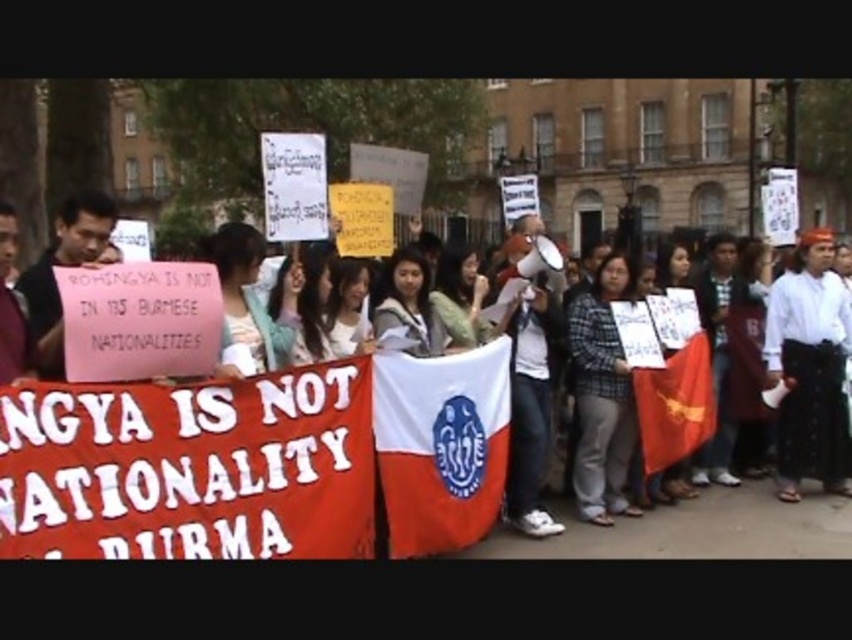
You are a photographer trying to capture the white fabric flag at center in the protest scene. Based on its position coordinates, where should you aim your camera to ensure the flag is centered in your shot?

The white fabric flag at center is located at coordinates point (441,445), so you should aim your camera at that specific point to center the flag in your shot.

You are a photographer trying to capture the protest scene. You want to ensure both the white fabric banner at center and the white fabric flag at center are clearly visible in your photo. Given their sizes, which object should you focus on first to ensure it doesn

The white fabric banner at center is much taller than the white fabric flag at center, so you should focus on capturing the white fabric banner at center first to ensure it is positioned correctly in the frame.